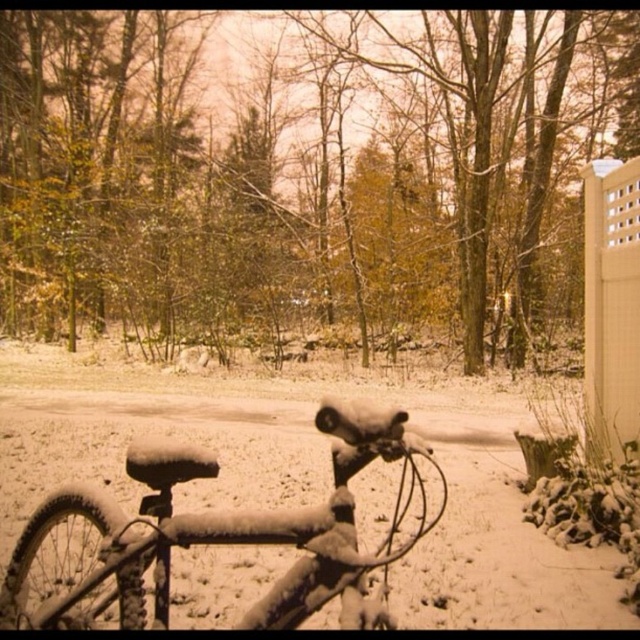
You are standing at the center of the image and want to walk towards the point marked at coordinates (228, 532). Which object from the scene will you encounter first?

The point at coordinates (228, 532) corresponds to the slightly frosty matte metal mountain bike at lower left, so you will encounter the slightly frosty matte metal mountain bike at lower left first.

You are a delivery person needing to pass through the area between the slightly frosty matte metal mountain bike at lower left and the white lattice fence at right. Can your 1.2 meter wide delivery cart fit through the space between them?

The slightly frosty matte metal mountain bike at lower left is wider than the white lattice fence at right. Since the width of the bike is greater than the fence, the space between them might be narrower than the fence width. However, without exact distance, it is uncertain if the 1.2 meter cart can fit. The answer requires more information about the actual spacing between the two objects.

You are standing in the winter scene and want to take a photo of the slightly frosty matte metal mountain bike at lower left and the white lattice fence at right. Which object should you focus on first if you want both to be in clear focus?

You should focus on the slightly frosty matte metal mountain bike at lower left first because it is closer to the viewer than the white lattice fence at right, ensuring both will be in focus when using depth of field appropriately.